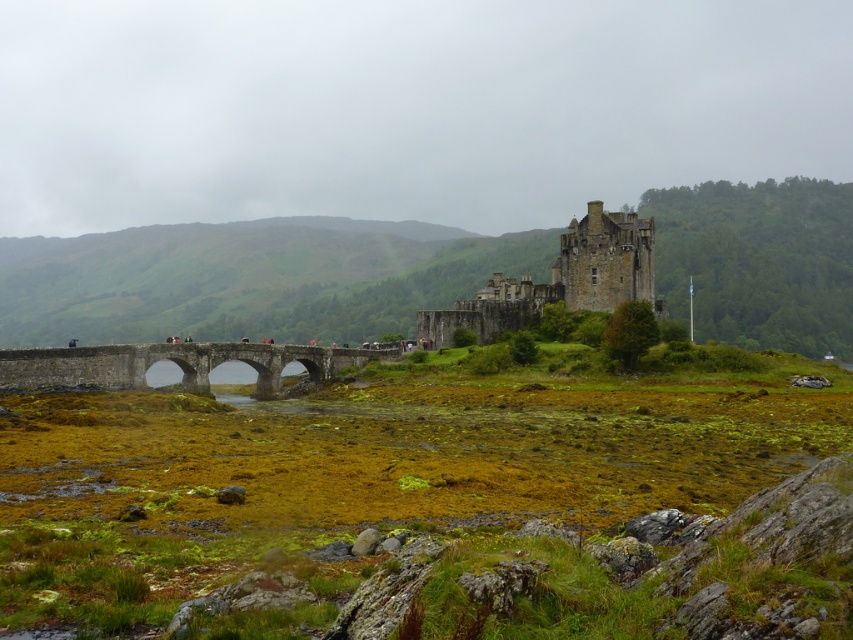
You are standing at the base of the historic stone castle and want to walk to the stone bridge with three arches. You have two options to reach the bridge quickly. One path leads to point (590, 294) and the other to point (280, 355). Which point should you choose to reach the bridge faster?

Point (590, 294) is further to the viewer than point (280, 355). Therefore, choosing the path to point (590, 294) will get you to the bridge faster since it is closer to your current position.

You are standing at the base of the stone medieval castle at center. If you walk straight ahead, which direction will you face relative to the castle?

Since the castle is at the center, walking straight ahead from its base would mean moving away from the castle in the direction opposite to its center.